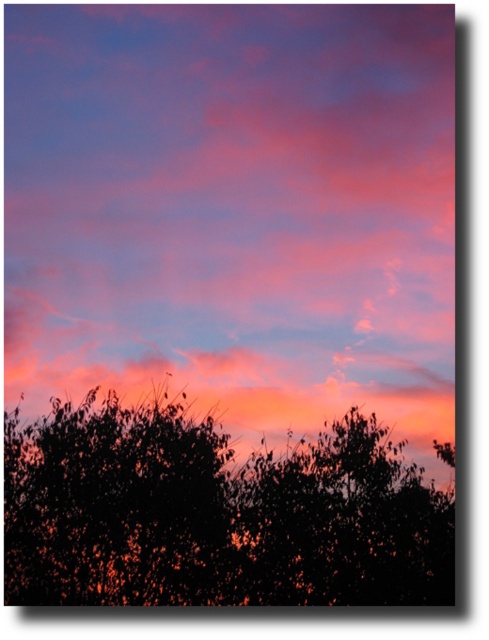
Which of these two, pink cotton candy cloud at upper center or black leafy tree at bottom, stands taller?

pink cotton candy cloud at upper center

Which is more to the left, pink cotton candy cloud at upper center or black leafy tree at bottom?

Positioned to the left is black leafy tree at bottom.

Which is in front, point (377, 160) or point (8, 504)?

Point (8, 504) is in front.

Locate an element on the screen. This screenshot has height=640, width=489. pink cotton candy cloud at upper center is located at coordinates (234, 211).